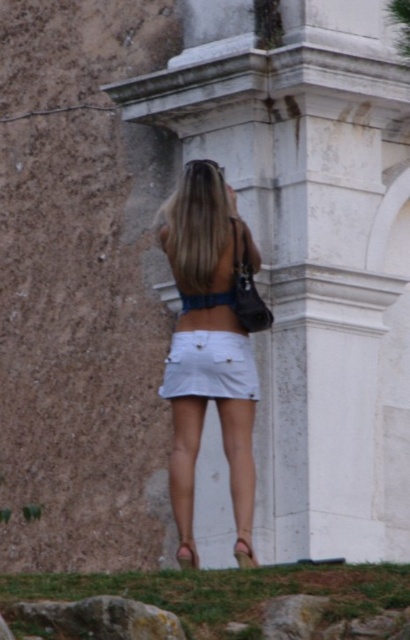
Which is in front, point (161, 227) or point (236, 394)?

Point (236, 394) is more forward.

Does white denim skirt at center have a smaller size compared to white cotton skirt at center?

Actually, white denim skirt at center might be larger than white cotton skirt at center.

Identify the location of white denim skirt at center. (207, 348).

Is white marble pillar at center taller than gray rough rock at lower left?

Yes.

Describe the element at coordinates (311, 250) in the screenshot. The image size is (410, 640). I see `white marble pillar at center` at that location.

Where is `white marble pillar at center`? The height and width of the screenshot is (640, 410). white marble pillar at center is located at coordinates (311, 250).

Between white marble pillar at center and white denim skirt at center, which one has more height?

white marble pillar at center

Is white marble pillar at center to the left of white denim skirt at center from the viewer's perspective?

Incorrect, white marble pillar at center is not on the left side of white denim skirt at center.

Image resolution: width=410 pixels, height=640 pixels. Identify the location of white marble pillar at center. (311, 250).

This screenshot has height=640, width=410. In order to click on white marble pillar at center in this screenshot , I will do `click(311, 250)`.